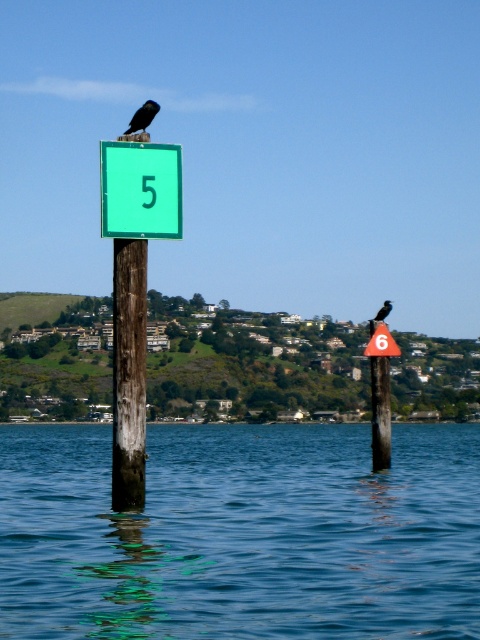
Question: Among these objects, which one is nearest to the camera?

Choices:
 (A) smooth wood post at right
 (B) transparent blue water at center
 (C) orange plastic triangle at right

Answer: (B)

Question: Based on their relative distances, which object is nearer to the orange plastic triangle at right?

Choices:
 (A) weathered wood post at left
 (B) smooth wood post at right

Answer: (B)

Question: Can you confirm if weathered wood post at left is positioned above teal matte sign at upper center?

Choices:
 (A) no
 (B) yes

Answer: (A)

Question: Considering the relative positions of smooth wood post at right and orange plastic triangle at right in the image provided, where is smooth wood post at right located with respect to orange plastic triangle at right?

Choices:
 (A) below
 (B) above

Answer: (A)

Question: Can you confirm if orange plastic triangle at right is wider than teal matte sign at upper center?

Choices:
 (A) no
 (B) yes

Answer: (B)

Question: Estimate the real-world distances between objects in this image. Which object is closer to the teal matte sign at upper center?

Choices:
 (A) black glossy crow at upper center
 (B) orange plastic triangle at right

Answer: (B)